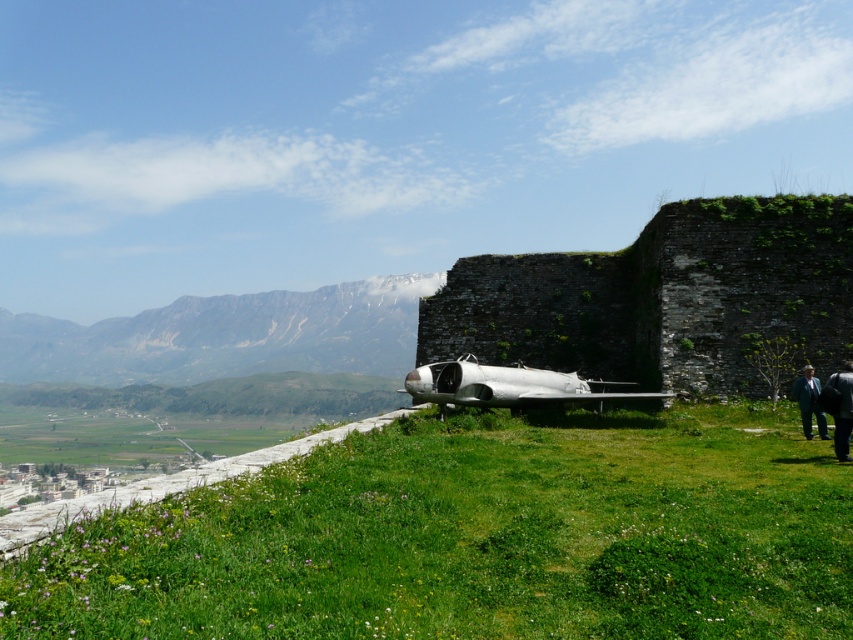
Which is more to the left, stone wall at center or dark blue suit at lower right?

From the viewer's perspective, stone wall at center appears more on the left side.

Between stone wall at center and dark blue suit at lower right, which one is positioned higher?

stone wall at center is above.

Does point (763, 284) come farther from viewer compared to point (801, 417)?

Yes, point (763, 284) is farther from viewer.

I want to click on stone wall at center, so click(x=663, y=298).

Is stone wall at center to the right of dark gray suit at lower right from the viewer's perspective?

No, stone wall at center is not to the right of dark gray suit at lower right.

Can you confirm if stone wall at center is positioned to the left of dark gray suit at lower right?

Yes, stone wall at center is to the left of dark gray suit at lower right.

At what (x,y) coordinates should I click in order to perform the action: click on stone wall at center. Please return your answer as a coordinate pair (x, y). The image size is (853, 640). Looking at the image, I should click on (663, 298).

Does green grassy at lower center have a smaller size compared to dark gray suit at lower right?

No, green grassy at lower center is not smaller than dark gray suit at lower right.

The image size is (853, 640). What do you see at coordinates (476, 538) in the screenshot?
I see `green grassy at lower center` at bounding box center [476, 538].

Is point (772, 588) positioned behind point (842, 456)?

That is False.

Identify the location of green grassy at lower center. (476, 538).